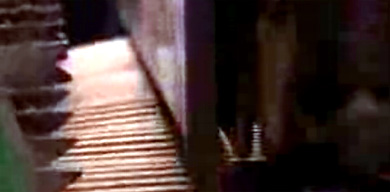
Identify the location of wall. The image size is (390, 192). (162, 39).